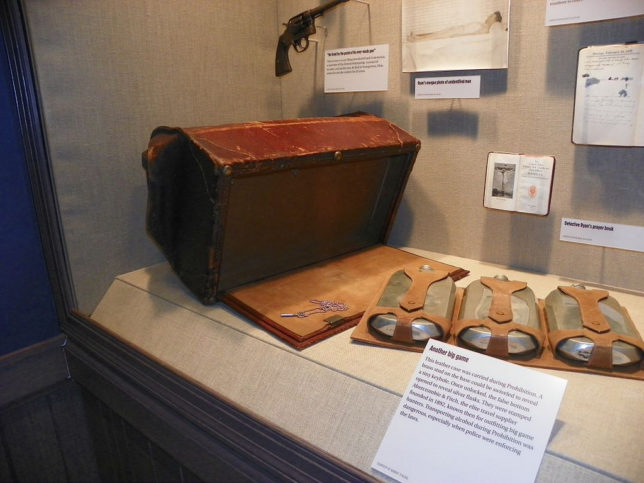
This screenshot has width=644, height=483. I want to click on box, so click(275, 143).